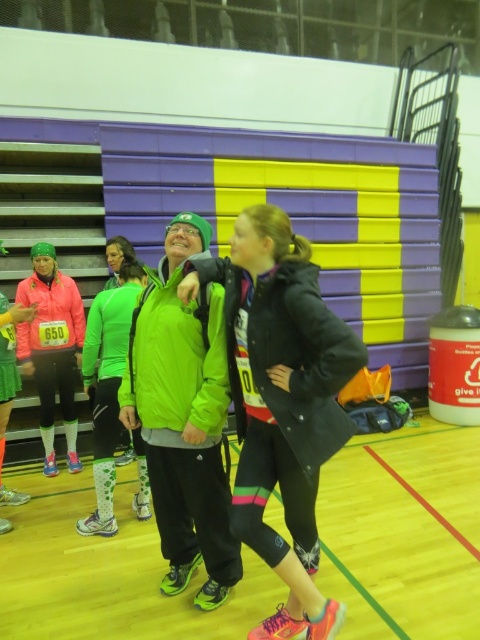
From the picture: You are a photographer standing at the back of the gymnasium. You want to take a photo of the shiny black shoes at center and the matte black jacket at center. Which object should you focus on first if you want to capture both clearly in your shot?

The shiny black shoes at center is positioned under matte black jacket at center, so you should focus on the matte black jacket at center first as it is closer to the camera.

What are the coordinates of the matte black jacket at center?

The coordinates of the matte black jacket at center are at point (282, 401).

You are a photographer at the indoor running event. You need to capture a photo of both the shiny black shoes at center and the matte pink jacket at center. Based on their positions, which object should you focus on first to ensure both are in the frame?

The shiny black shoes at center is positioned on the right side of matte pink jacket at center, so you should focus on the matte pink jacket at center first to ensure both are in the frame.